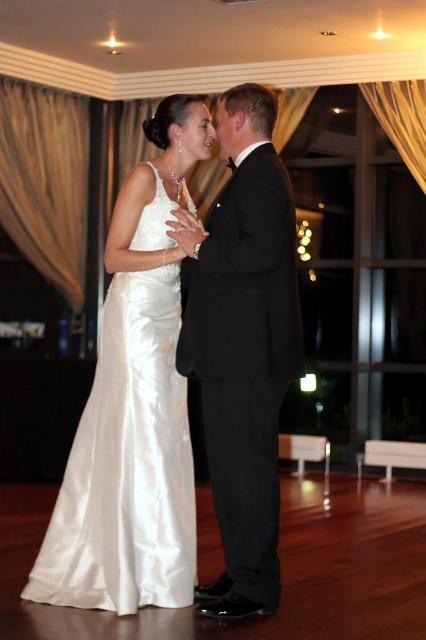
Who is taller, black satin suit at center or satin/smooth dress at left?

With more height is black satin suit at center.

Does black satin suit at center appear under satin/smooth dress at left?

No, black satin suit at center is not below satin/smooth dress at left.

Is point (232, 157) more distant than point (100, 380)?

No, (232, 157) is in front of (100, 380).

Where is `black satin suit at center`? The width and height of the screenshot is (426, 640). black satin suit at center is located at coordinates (242, 346).